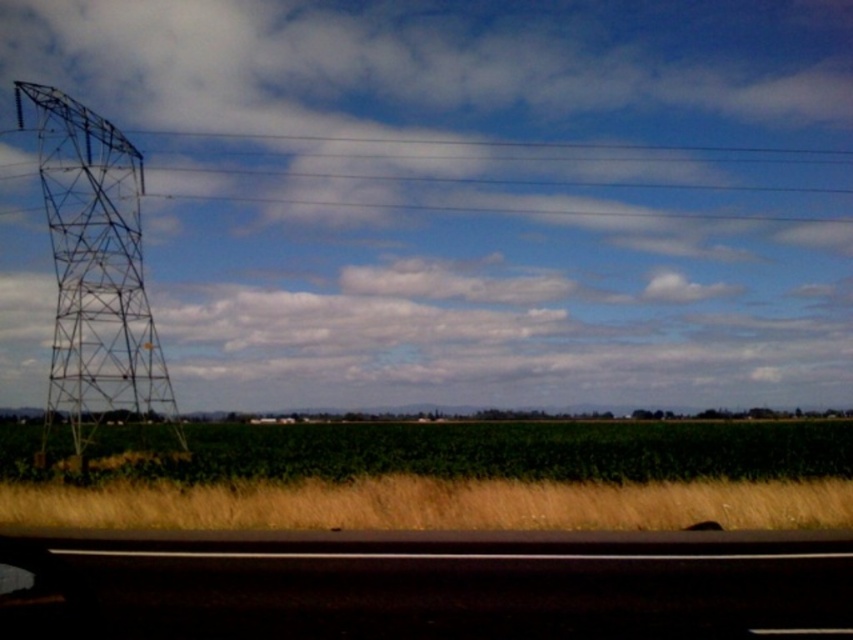
You are a photographer standing at the edge of the black asphalt highway at lower center. You want to take a picture of the metallic grid tower at left. Considering your current position, will the tower appear larger or smaller in the photo compared to if you were standing closer to it?

The metallic grid tower at left will appear smaller in the photo because you are currently positioned closer to the black asphalt highway at lower center, which is farther away from the tower than if you were standing closer to it.

You are standing at the point marked by the coordinate point at point (827, 604). You want to walk directly towards the large metal transmission tower on the left. How far will you have to walk to reach the base of the tower?

The distance between the point marked by the coordinate point at point (827, 604) and the large metal transmission tower on the left is 31.69 feet, so you will have to walk 31.69 feet to reach the base of the tower.